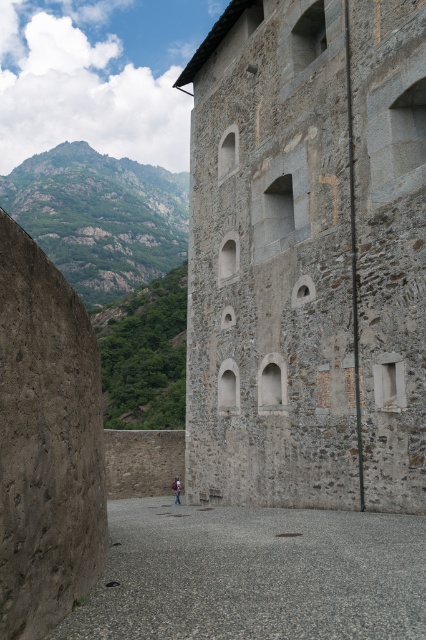
Does gray stone wall at center have a larger size compared to light brown leather jacket at lower center?

Correct, gray stone wall at center is larger in size than light brown leather jacket at lower center.

Describe the element at coordinates (307, 257) in the screenshot. The width and height of the screenshot is (426, 640). I see `gray stone wall at center` at that location.

Which is in front, point (363, 276) or point (176, 481)?

Point (363, 276) is more forward.

Identify the location of gray stone wall at center. The width and height of the screenshot is (426, 640). (307, 257).

In the scene shown: Does gray stone wall at center have a greater width compared to gray gravel alley at center?

Incorrect, gray stone wall at center's width does not surpass gray gravel alley at center's.

Is point (218, 141) closer to camera compared to point (187, 628)?

No, it is behind (187, 628).

At what (x,y) coordinates should I click in order to perform the action: click on gray stone wall at center. Please return your answer as a coordinate pair (x, y). This screenshot has width=426, height=640. Looking at the image, I should click on (307, 257).

Between gray gravel alley at center and light brown leather jacket at lower center, which one has more height?

gray gravel alley at center

Which is behind, point (221, 586) or point (178, 486)?

The point (178, 486) is behind.

Identify the location of gray gravel alley at center. Image resolution: width=426 pixels, height=640 pixels. tap(253, 573).

Identify the location of gray gravel alley at center. (253, 573).